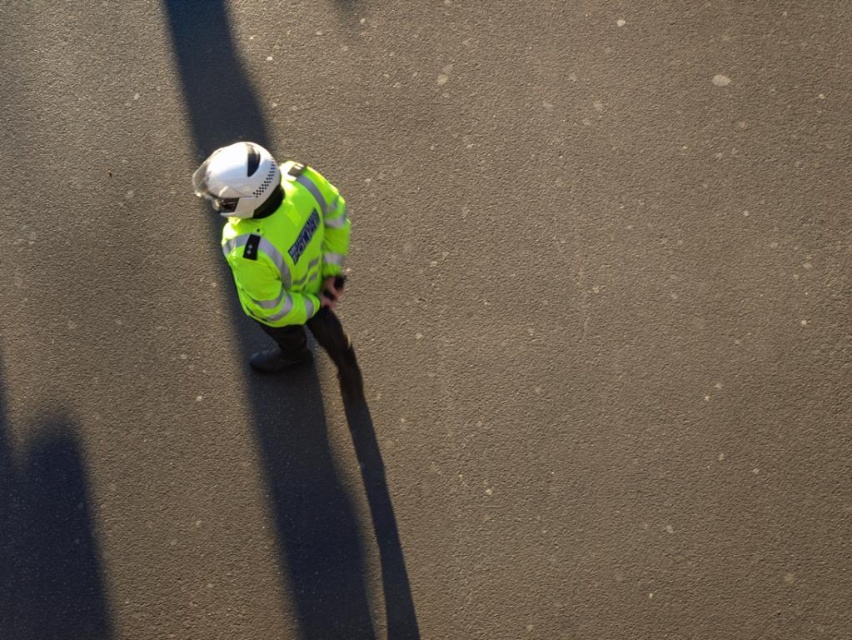
You are a pedestrian standing on the paved surface in the image. You see a point marked at coordinates [281,252]. What object is located at that point?

The point at coordinates [281,252] marks the location of the high visibility fabric jacket at center.